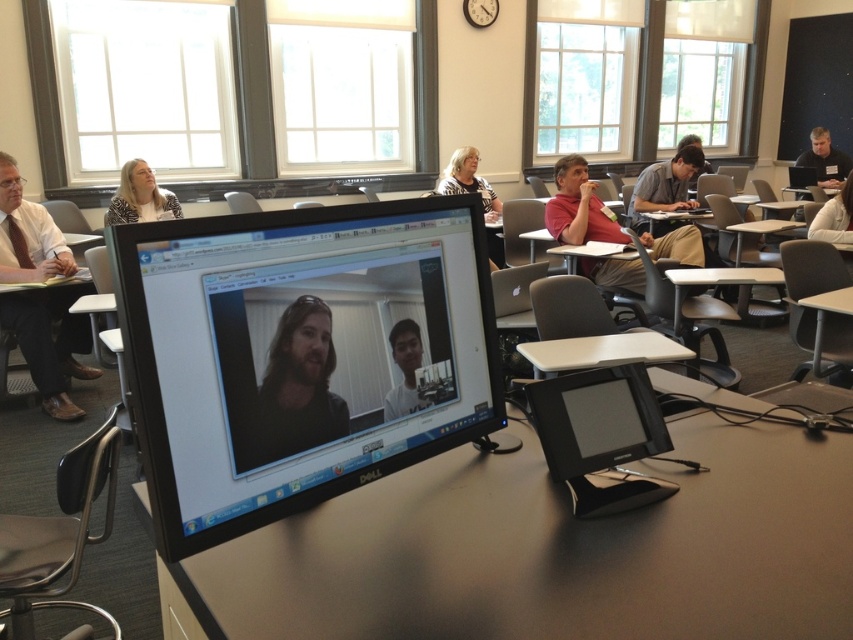
You are a student in the classroom and you want to describe the video call participants visible on the Dell computer monitor. Which participant is positioned lower on the screen between the light brown hair at upper center and the matte black laptop at upper center?

The light brown hair at upper center is positioned lower on the screen than the matte black laptop at upper center.

You are a student in the classroom and want to see both the light brown hair at upper center and the matte black laptop at upper center clearly. Which one appears larger in your view?

The light brown hair at upper center appears larger because it is closer to the viewer than the matte black laptop at upper center.